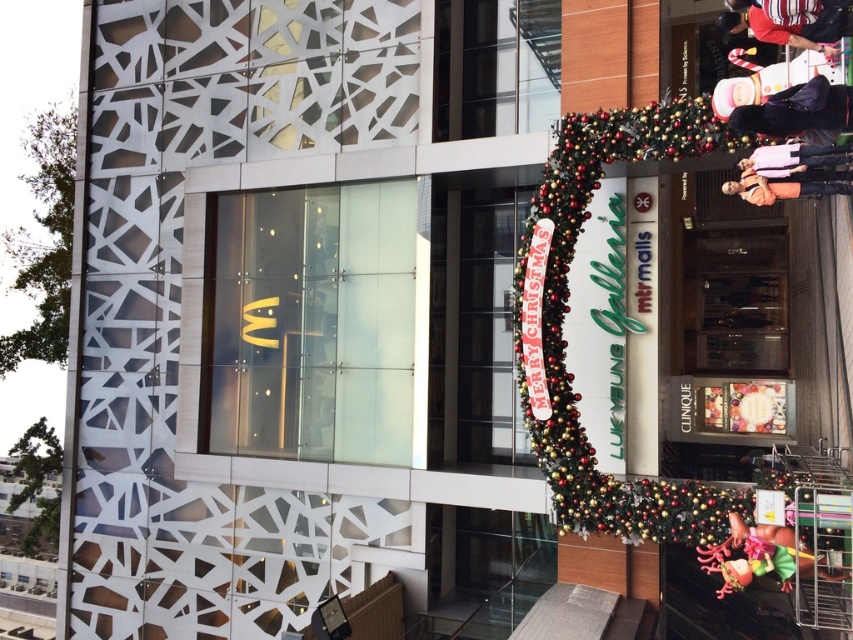
Question: Is striped fabric shirt at upper right to the right of white fabric at upper right from the viewer's perspective?

Choices:
 (A) yes
 (B) no

Answer: (A)

Question: Which object appears farthest from the camera in this image?

Choices:
 (A) orange fabric person at upper right
 (B) striped fabric shirt at upper right
 (C) shiny metallic santa claus at lower right
 (D) dark blue jacket at upper right

Answer: (A)

Question: Which object is the farthest from the gold metallic garland at center right?

Choices:
 (A) white fabric at upper right
 (B) striped fabric shirt at upper right
 (C) shiny metallic santa claus at lower right
 (D) orange fabric person at upper right

Answer: (B)

Question: Which point is closer to the camera?

Choices:
 (A) (759, 198)
 (B) (846, 118)
 (C) (679, 531)
 (D) (764, 172)

Answer: (B)

Question: Is gold metallic garland at center right thinner than dark blue jacket at upper right?

Choices:
 (A) no
 (B) yes

Answer: (A)

Question: Is dark blue jacket at upper right smaller than white fabric at upper right?

Choices:
 (A) yes
 (B) no

Answer: (A)